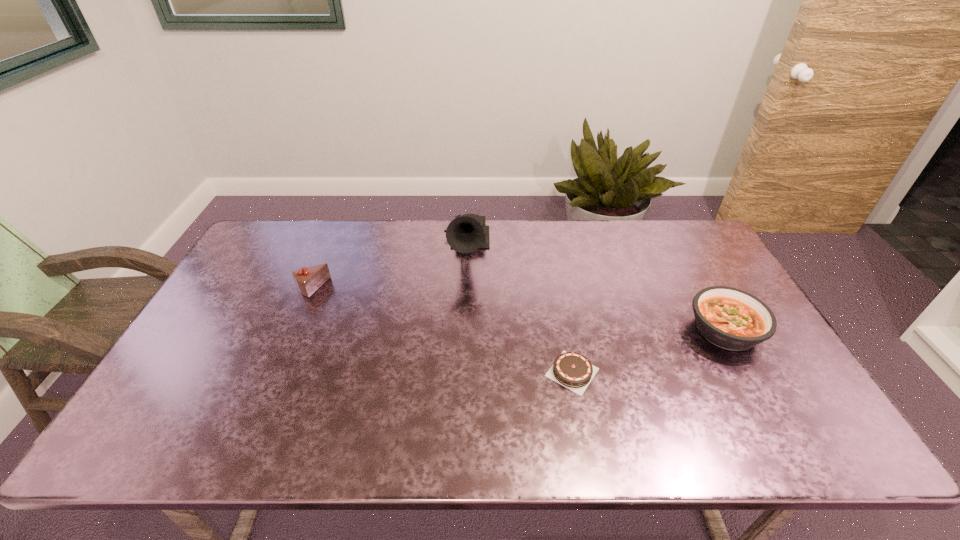
Locate an element on the screen. The height and width of the screenshot is (540, 960). free space between the rightmost object and the taller chocolate cake is located at coordinates (518, 309).

The image size is (960, 540). I want to click on free space between the third object from left to right and the phonograph_record, so click(x=519, y=311).

Identify the location of free area in between the phonograph_record and the stew. The width and height of the screenshot is (960, 540). (595, 290).

The height and width of the screenshot is (540, 960). I want to click on free space between the tallest object and the left chocolate cake, so click(x=389, y=269).

Locate an element on the screen. Image resolution: width=960 pixels, height=540 pixels. vacant space that's between the tallest object and the stew is located at coordinates (595, 290).

What are the coordinates of `unoccupied area between the tallest object and the stew` in the screenshot? It's located at (595, 290).

This screenshot has width=960, height=540. I want to click on vacant space that is in between the phonograph_record and the taller chocolate cake, so click(x=389, y=269).

Where is `empty space between the third object from right to left and the shorter chocolate cake`? The height and width of the screenshot is (540, 960). empty space between the third object from right to left and the shorter chocolate cake is located at coordinates (519, 311).

In order to click on blank region between the third object from right to left and the leftmost object in this screenshot , I will do `click(389, 269)`.

Where is `object that is the third closest to the tallest object`? object that is the third closest to the tallest object is located at coordinates [732, 319].